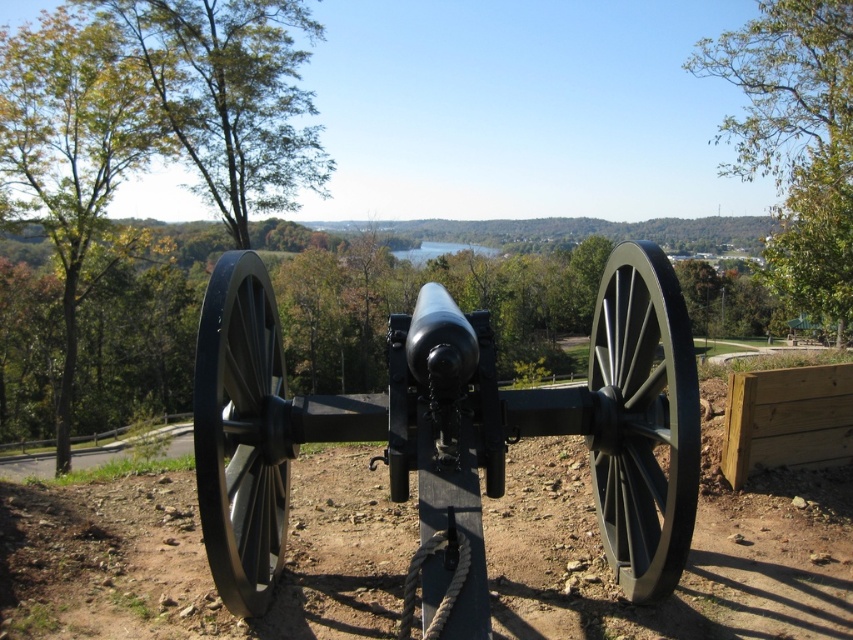
Question: Does green leafy tree at left appear on the left side of clear water at center?

Choices:
 (A) no
 (B) yes

Answer: (B)

Question: Is green leafy tree at upper left wider than clear water at center?

Choices:
 (A) no
 (B) yes

Answer: (B)

Question: Which point appears farthest from the camera in this image?

Choices:
 (A) (78, 128)
 (B) (393, 257)
 (C) (230, 124)

Answer: (B)

Question: Is green leafy tree at upper right to the right of green leafy tree at left from the viewer's perspective?

Choices:
 (A) yes
 (B) no

Answer: (A)

Question: Which point is farther to the camera?

Choices:
 (A) (225, 550)
 (B) (717, 42)

Answer: (B)

Question: Among these points, which one is nearest to the camera?

Choices:
 (A) (482, 253)
 (B) (115, 124)
 (C) (842, 118)
 (D) (311, 160)

Answer: (C)